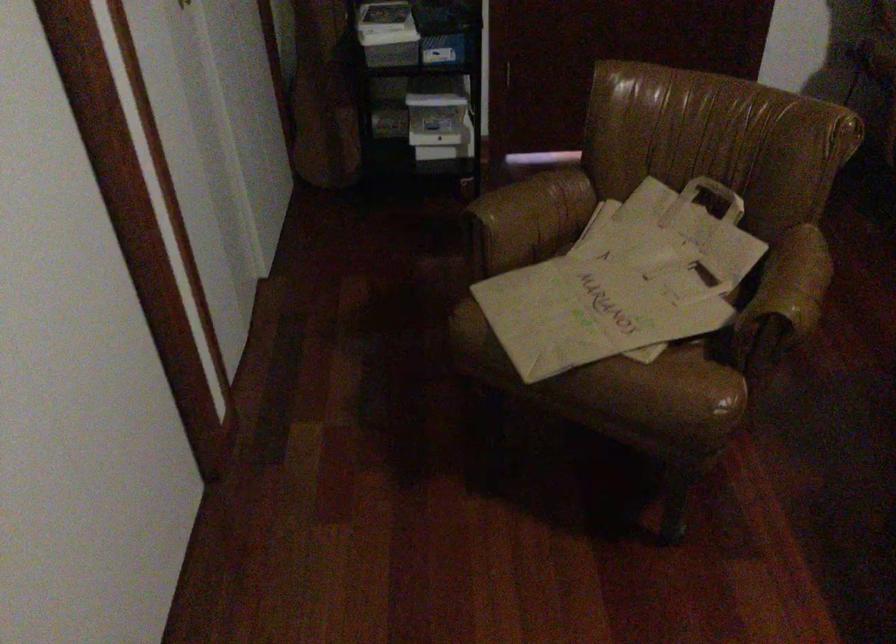
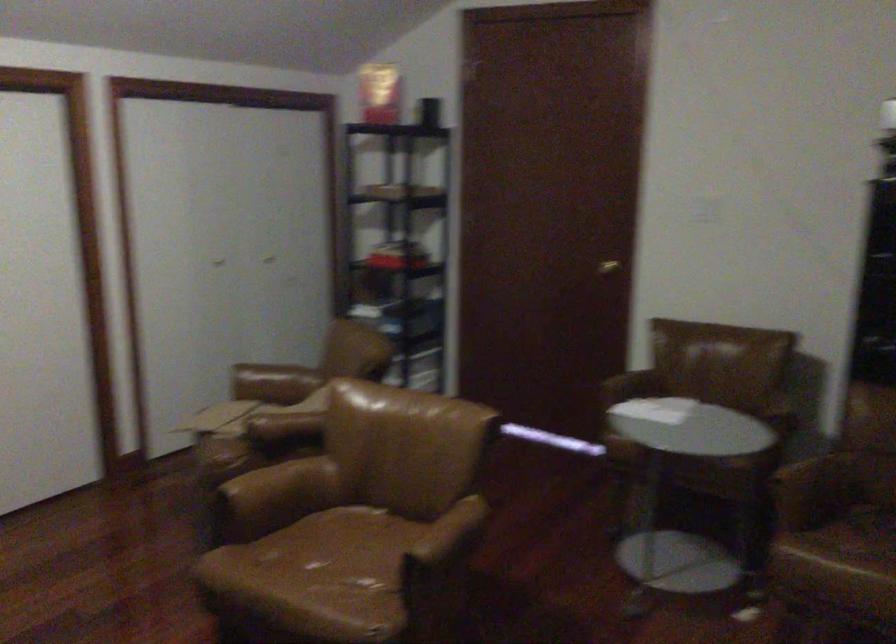
Question: I am providing you with two images of the same scene from different viewpoints. Please identify which objects are invisible in image2.

Choices:
 (A) black mesh bag
 (B) brown chair armrest
 (C) paper bag handle
 (D) gold door handle

Answer: (C)